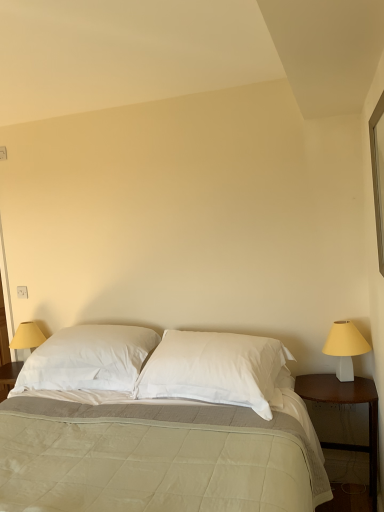
Locate an element on the screen. Image resolution: width=384 pixels, height=512 pixels. wooden nightstand at right is located at coordinates (347, 402).

What do you see at coordinates (215, 369) in the screenshot?
I see `white soft pillow at center, which is the second pillow in left-to-right order` at bounding box center [215, 369].

Image resolution: width=384 pixels, height=512 pixels. Find the location of `white quilted fabric bed at center`. white quilted fabric bed at center is located at coordinates (157, 426).

Measure the distance between point (374, 194) and camera.

The distance of point (374, 194) from camera is 2.17 meters.

In order to face clear glass window at upper right, should I rotate leftwards or rightwards?

It's best to rotate right around 24.670 degrees.

Where is `white matte lampshade at right`? This screenshot has width=384, height=512. white matte lampshade at right is located at coordinates (345, 348).

Does white soft pillow at center, which appears as the 1th pillow when viewed from the right, appear on the right side of white quilted fabric bed at center?

Indeed, white soft pillow at center, which appears as the 1th pillow when viewed from the right, is positioned on the right side of white quilted fabric bed at center.

Image resolution: width=384 pixels, height=512 pixels. I want to click on pillow on the right side of white quilted fabric bed at center, so click(x=215, y=369).

Considering the sizes of objects white soft pillow at center, which appears as the 1th pillow when viewed from the right, and white quilted fabric bed at center in the image provided, who is thinner, white soft pillow at center, which appears as the 1th pillow when viewed from the right, or white quilted fabric bed at center?

Thinner between the two is white soft pillow at center, which appears as the 1th pillow when viewed from the right.

Considering the positions of points (162, 371) and (270, 448), is point (162, 371) closer to camera compared to point (270, 448)?

No, it is behind (270, 448).

Considering the relative positions of wooden nightstand at right and clear glass window at upper right in the image provided, is wooden nightstand at right to the right of clear glass window at upper right from the viewer's perspective?

Yes.

Is wooden nightstand at right surrounding clear glass window at upper right?

No, clear glass window at upper right is not a part of wooden nightstand at right.

Considering the sizes of objects wooden nightstand at right and clear glass window at upper right in the image provided, who is bigger, wooden nightstand at right or clear glass window at upper right?

wooden nightstand at right.

Looking at this image, between white matte lampshade at right and wooden nightstand at right, which one has larger width?

Wider between the two is wooden nightstand at right.

Is white matte lampshade at right not within wooden nightstand at right?

white matte lampshade at right lies outside wooden nightstand at right's area.

Is white matte lampshade at right shorter than wooden nightstand at right?

Yes.

Is white matte lampshade at right further to the viewer compared to wooden nightstand at right?

That is True.

Consider the image. Does white matte lampshade at right contain clear glass window at upper right?

No, clear glass window at upper right is not a part of white matte lampshade at right.

Is white matte lampshade at right in front of or behind clear glass window at upper right in the image?

In the image, white matte lampshade at right appears behind clear glass window at upper right.

From the image's perspective, which one is positioned higher, white matte lampshade at right or clear glass window at upper right?

clear glass window at upper right is shown above in the image.

Which object is thinner, white matte lampshade at right or clear glass window at upper right?

With smaller width is clear glass window at upper right.

Looking at this image, from a real-world perspective, who is located lower, clear glass window at upper right or wooden nightstand at right?

wooden nightstand at right, from a real-world perspective.

Between clear glass window at upper right and wooden nightstand at right, which one appears on the right side from the viewer's perspective?

wooden nightstand at right.

Consider the image. Relative to wooden nightstand at right, is clear glass window at upper right in front or behind?

Clearly, clear glass window at upper right is in front of wooden nightstand at right.

Can we say clear glass window at upper right lies outside wooden nightstand at right?

Yes, clear glass window at upper right is outside of wooden nightstand at right.

Considering the positions of points (94, 376) and (205, 348), is point (94, 376) closer to camera compared to point (205, 348)?

No, it is behind (205, 348).

Who is smaller, white soft pillow at center, which is the 2th pillow from right to left, or white soft pillow at center, which appears as the 1th pillow when viewed from the right?

With smaller size is white soft pillow at center, which appears as the 1th pillow when viewed from the right.

Locate an element on the screen. The height and width of the screenshot is (512, 384). pillow below the white soft pillow at center, which is the 2th pillow from right to left (from a real-world perspective) is located at coordinates (215, 369).

From the image's perspective, which one is positioned higher, white soft pillow at center, which is the 2th pillow from right to left, or white soft pillow at center, which appears as the 1th pillow when viewed from the right?

white soft pillow at center, which is the 2th pillow from right to left.

What's the angular difference between clear glass window at upper right and white soft pillow at center, which appears as the 1th pillow when viewed from the right,'s facing directions?

There is a 87.6-degree angle between the facing directions of clear glass window at upper right and white soft pillow at center, which appears as the 1th pillow when viewed from the right.

From a real-world perspective, which is physically below, clear glass window at upper right or white soft pillow at center, which is the second pillow in left-to-right order?

white soft pillow at center, which is the second pillow in left-to-right order, is physically lower.

Between point (381, 191) and point (269, 405), which one is positioned behind?

Positioned behind is point (381, 191).

Considering the relative positions of clear glass window at upper right and white soft pillow at center, which is the second pillow in left-to-right order, in the image provided, is clear glass window at upper right to the right of white soft pillow at center, which is the second pillow in left-to-right order, from the viewer's perspective?

Indeed, clear glass window at upper right is positioned on the right side of white soft pillow at center, which is the second pillow in left-to-right order.

The height and width of the screenshot is (512, 384). I want to click on pillow that is the 1st one above the white quilted fabric bed at center (from a real-world perspective), so click(x=215, y=369).

Find the location of a particular element. This screenshot has height=512, width=384. window in front of the wooden nightstand at right is located at coordinates (377, 178).

Which object lies nearer to the anchor point clear glass window at upper right, white soft pillow at center, which is the second pillow in left-to-right order, or white soft pillow at center, which is the 2th pillow from right to left?

Based on the image, white soft pillow at center, which is the second pillow in left-to-right order, appears to be nearer to clear glass window at upper right.

Estimate the real-world distances between objects in this image. Which object is further from wooden nightstand at right, white quilted fabric bed at center or clear glass window at upper right?

The object further to wooden nightstand at right is clear glass window at upper right.

Estimate the real-world distances between objects in this image. Which object is further from white matte lampshade at right, wooden nightstand at right or white soft pillow at center, which is the 2th pillow from right to left?

white soft pillow at center, which is the 2th pillow from right to left, is further to white matte lampshade at right.

Considering their positions, is wooden nightstand at right positioned further to white soft pillow at center, which is the first pillow in left-to-right order, than white quilted fabric bed at center?

wooden nightstand at right lies further to white soft pillow at center, which is the first pillow in left-to-right order, than the other object.

From the picture: Considering their positions, is white matte lampshade at right positioned further to white soft pillow at center, which is the first pillow in left-to-right order, than wooden nightstand at right?

The object further to white soft pillow at center, which is the first pillow in left-to-right order, is white matte lampshade at right.

Looking at the image, which one is located closer to clear glass window at upper right, wooden nightstand at right or white soft pillow at center, which is the second pillow in left-to-right order?

Among the two, wooden nightstand at right is located nearer to clear glass window at upper right.

When comparing their distances from white soft pillow at center, which appears as the 1th pillow when viewed from the right, does clear glass window at upper right or wooden nightstand at right seem further?

clear glass window at upper right lies further to white soft pillow at center, which appears as the 1th pillow when viewed from the right, than the other object.

Estimate the real-world distances between objects in this image. Which object is closer to white quilted fabric bed at center, wooden nightstand at right or white matte lampshade at right?

wooden nightstand at right is closer to white quilted fabric bed at center.

Locate an element on the screen. bed located between clear glass window at upper right and white matte lampshade at right in the depth direction is located at coordinates (157, 426).

Where is `pillow between white soft pillow at center, which is the 2th pillow from right to left, and white matte lampshade at right, in the horizontal direction`? This screenshot has height=512, width=384. pillow between white soft pillow at center, which is the 2th pillow from right to left, and white matte lampshade at right, in the horizontal direction is located at coordinates (215, 369).

Locate an element on the screen. The image size is (384, 512). window between white soft pillow at center, which is the 2th pillow from right to left, and wooden nightstand at right from left to right is located at coordinates (377, 178).

Find the location of a particular element. This screenshot has height=512, width=384. pillow between white quilted fabric bed at center and white matte lampshade at right in the front-back direction is located at coordinates (215, 369).